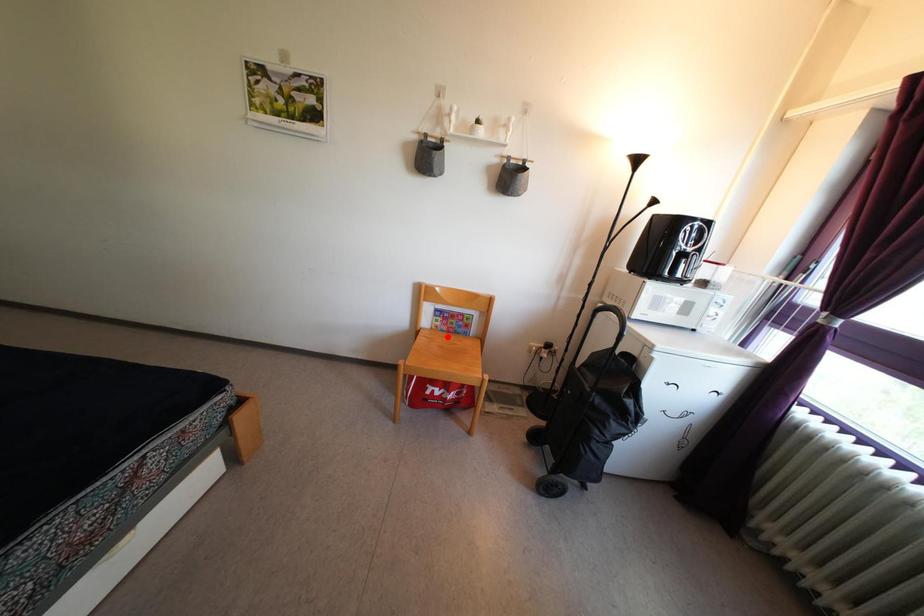
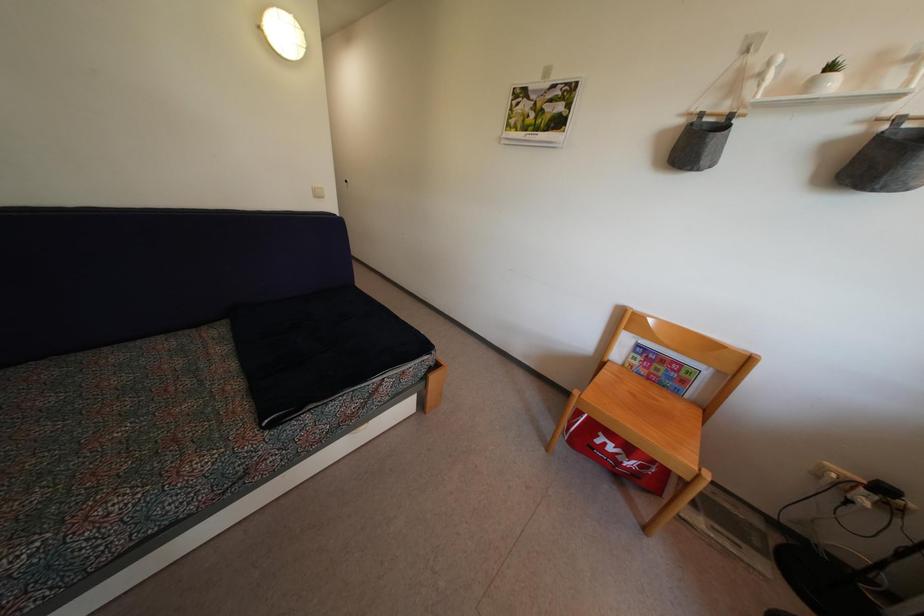
Question: I am providing you with two images of the same scene from different viewpoints. Image1 has a red point marked. In image2, the corresponding 3D location appears at what relative position? Reply with the corresponding letter.

Choices:
 (A) Closer
 (B) Farther

Answer: (A)